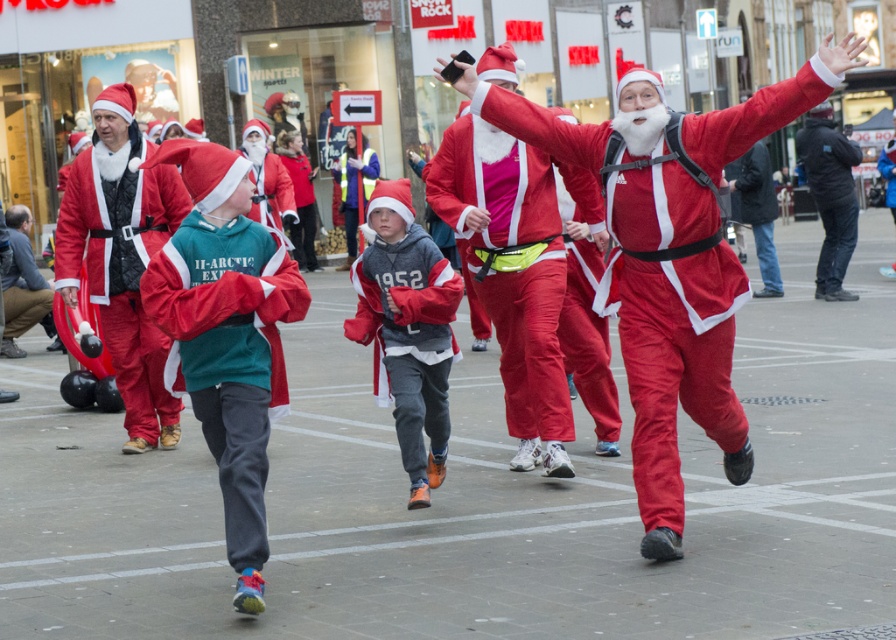
You are a photographer positioned at the starting line of the Santa Claus race. You want to capture a photo that includes both the gray fleece jacket at center and the black leather jacket at right. Given that your camera has a maximum focus range of 30 feet, will you be able to include both in the same frame without moving?

The distance between the gray fleece jacket at center and the black leather jacket at right is 33.47 feet, which exceeds the camera maximum focus range of 30 feet. Therefore, you cannot include both in the same frame without moving.

You are a photographer at the Santa Claus race event. You need to take a photo that includes both the gray fleece jacket at center and the black leather jacket at right. Based on their positions, which jacket should be positioned to the left in the frame?

The gray fleece jacket at center is to the left of the black leather jacket at right, so in the frame, the gray fleece jacket at center should be on the left side.